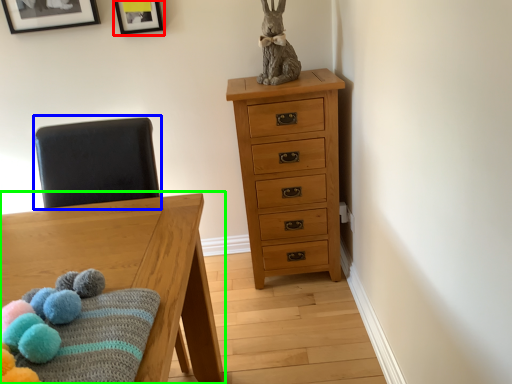
Question: Considering the real-world distances, which object is farthest from picture frame (highlighted by a red box)? swivel chair (highlighted by a blue box) or table (highlighted by a green box)?

Choices:
 (A) swivel chair
 (B) table

Answer: (B)